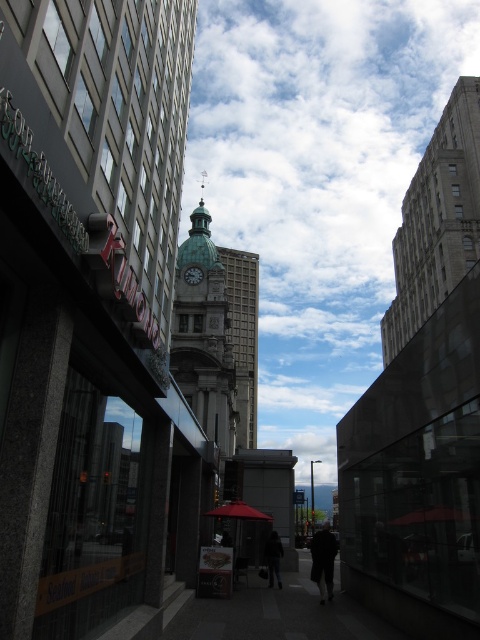
Question: Is dark fabric coat at center wider than dark gray jacket at center?

Choices:
 (A) yes
 (B) no

Answer: (A)

Question: Based on their relative distances, which object is farther from the silver metallic clock at center?

Choices:
 (A) matte red umbrella at center
 (B) gray stone building at upper right
 (C) gray concrete tower at center

Answer: (C)

Question: Considering the real-world distances, which object is closest to the gray concrete tower at center?

Choices:
 (A) matte red umbrella at center
 (B) dark fabric coat at center

Answer: (B)

Question: Is matte red umbrella at center to the right of dark gray jacket at center from the viewer's perspective?

Choices:
 (A) no
 (B) yes

Answer: (A)

Question: Among these objects, which one is nearest to the camera?

Choices:
 (A) gray stone building at upper right
 (B) matte red umbrella at center

Answer: (B)

Question: Is green marble clock tower at center to the right of gray concrete tower at center from the viewer's perspective?

Choices:
 (A) yes
 (B) no

Answer: (B)